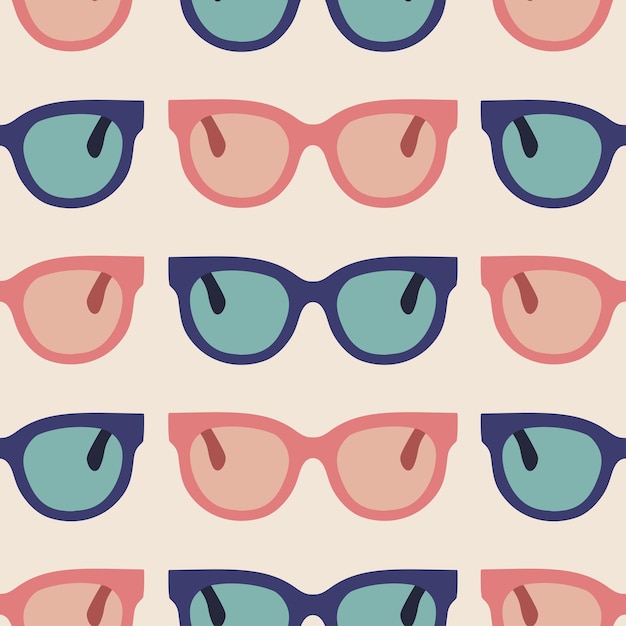
You are a GUI agent. You are given a task and a screenshot of the screen. Output one action in this format:
    pyautogui.click(x=<x>, y=<y>)
    Task: Click on the top row of glasses
    The width and height of the screenshot is (626, 626).
    Given the screenshot: What is the action you would take?
    pyautogui.click(x=562, y=23), pyautogui.click(x=401, y=19), pyautogui.click(x=262, y=14), pyautogui.click(x=74, y=14)